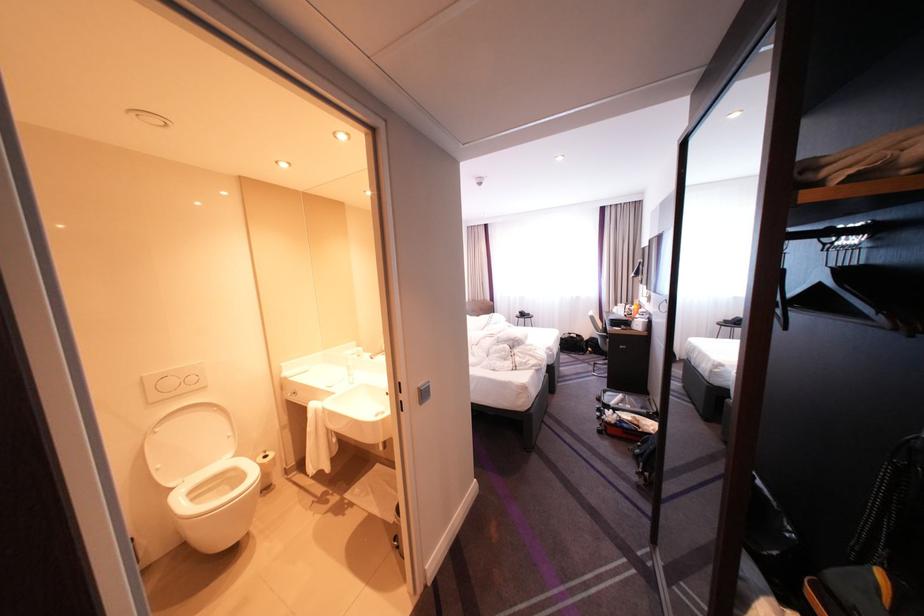
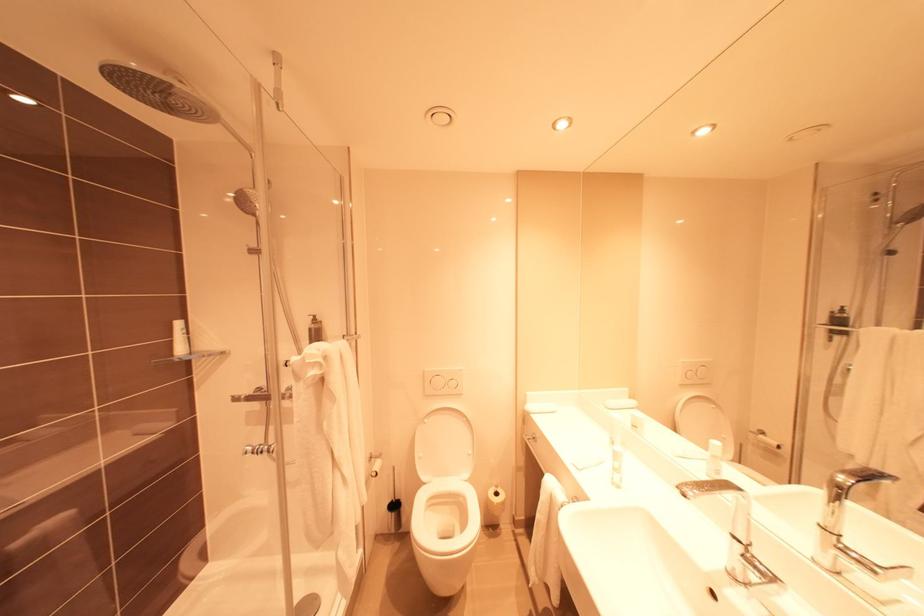
Question: Based on the continuous images, in which direction is the camera rotating? Reply with the corresponding letter.

Choices:
 (A) Left
 (B) Right
 (C) Up
 (D) Down

Answer: (A)